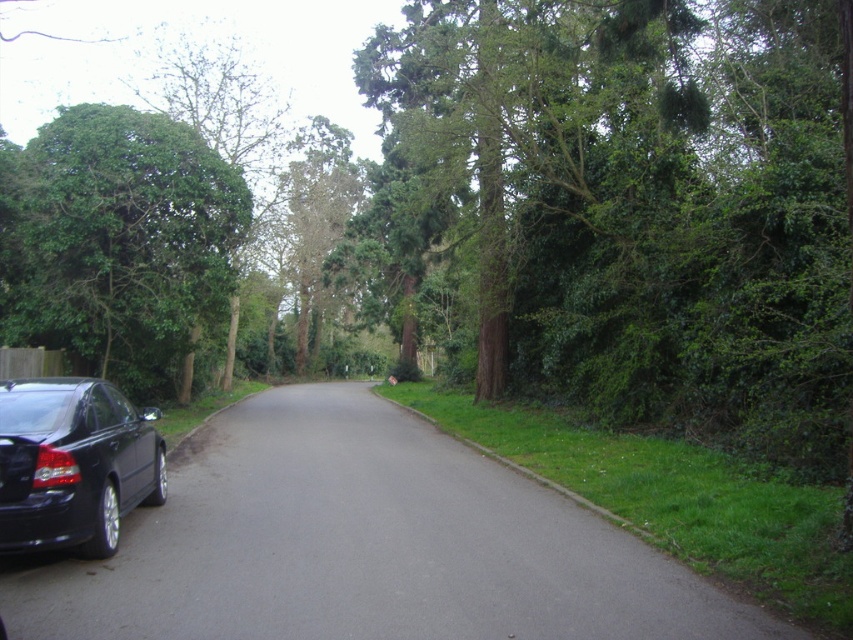
You are standing on the road and want to walk to the green leafy tree at left. Is the black asphalt driveway at lower left in your path?

Yes, the black asphalt driveway at lower left is in your path because it is closer to you than the green leafy tree at left, so you would need to walk past it to reach the tree.

You are driving a car that is 1.8 meters wide. You need to park your car on the side of the road where the glossy black car at lower left is parked. Is there enough space between the road and the green leafy tree at left for your car to park without hitting the tree?

The green leafy tree at left is wider than the glossy black car at lower left. Since the glossy black car at lower left is parked there, the space between the road and the tree must be at least as wide as the car. However, since the tree is wider, there might be enough space for your 1.8 meter wide car, but you should check the exact width difference to be sure.

You are standing at the intersection of the road and the driveway. You want to turn left onto the driveway. Which direction should you turn relative to the black asphalt driveway at lower left located at point (364, 545)?

The black asphalt driveway at lower left is located at point (364, 545), so you should turn left towards that direction to enter the driveway.